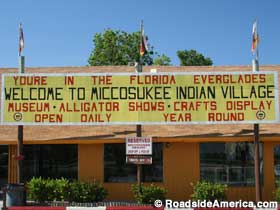
Identify the location of trashcan. Image resolution: width=280 pixels, height=210 pixels. (13, 197).